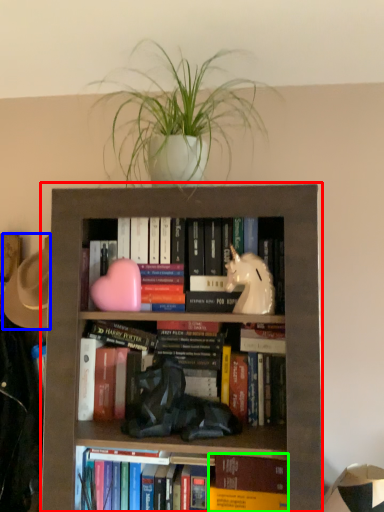
Question: Which object is positioned farthest from bookcase (highlighted by a red box)? Select from hat (highlighted by a blue box) and paperback book (highlighted by a green box).

Choices:
 (A) hat
 (B) paperback book

Answer: (A)